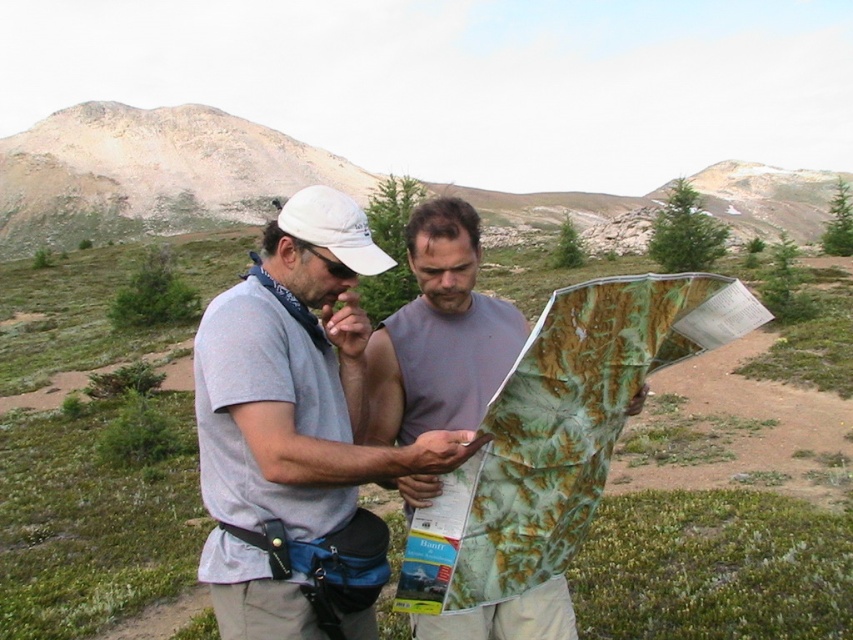
Question: Which point is closer to the camera taking this photo?

Choices:
 (A) (751, 188)
 (B) (534, 529)

Answer: (B)

Question: In this image, where is matte gray shirt at center located relative to rugged brown mountain at upper center?

Choices:
 (A) right
 (B) left

Answer: (B)

Question: Is green textured map at center above matte gray shirt at center?

Choices:
 (A) no
 (B) yes

Answer: (B)

Question: Which point is farther to the camera?

Choices:
 (A) matte gray shirt at center
 (B) rugged brown mountain at upper center

Answer: (B)

Question: Which is farther from the green textured map at center?

Choices:
 (A) matte gray shirt at center
 (B) rugged brown mountain at upper center

Answer: (B)

Question: Is green textured map at center below rugged brown mountain at upper center?

Choices:
 (A) yes
 (B) no

Answer: (A)